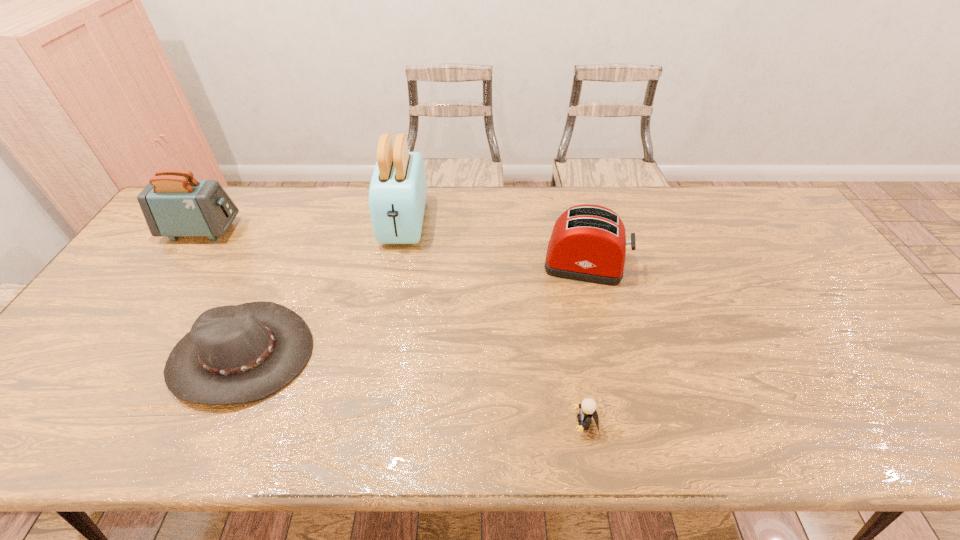
What are the coordinates of `the third object from left to right` in the screenshot? It's located at (397, 194).

Identify the location of the second toaster from left to right. Image resolution: width=960 pixels, height=540 pixels. (397, 194).

Where is `the leftmost object`? The width and height of the screenshot is (960, 540). the leftmost object is located at coordinates (174, 204).

I want to click on the leftmost toaster, so click(x=174, y=204).

The height and width of the screenshot is (540, 960). I want to click on the shortest toaster, so click(x=588, y=243).

The width and height of the screenshot is (960, 540). What are the coordinates of `the third tallest object` in the screenshot? It's located at (588, 243).

What are the coordinates of `the second object from left to right` in the screenshot? It's located at (234, 354).

At what (x,y) coordinates should I click in order to perform the action: click on hat. Please return your answer as a coordinate pair (x, y). Image resolution: width=960 pixels, height=540 pixels. Looking at the image, I should click on (234, 354).

Locate an element on the screen. Lego is located at coordinates (588, 406).

This screenshot has width=960, height=540. Find the location of `free space located 0.360m on the side of the third object from right to left with the lever`. free space located 0.360m on the side of the third object from right to left with the lever is located at coordinates point(380,350).